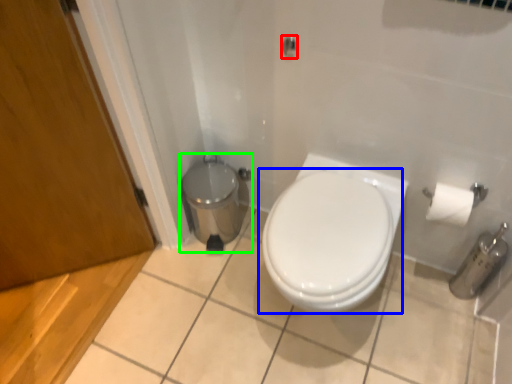
Question: Which object is the farthest from shower (highlighted by a red box)? Choose among these: toilet (highlighted by a blue box) or porcelain (highlighted by a green box).

Choices:
 (A) toilet
 (B) porcelain

Answer: (B)